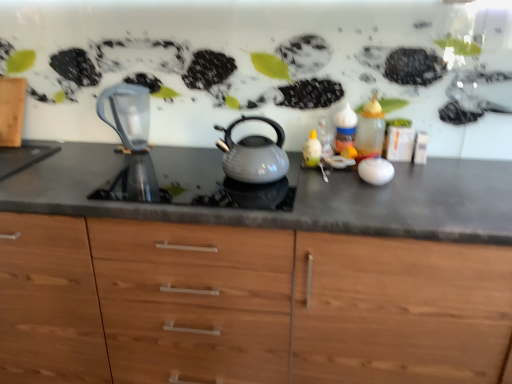
You are a GUI agent. You are given a task and a screenshot of the screen. Output one action in this format:
    pyautogui.click(x=<x>, y=<y>)
    Task: Click on the free location in front of matte gray kettle at center
    The width and height of the screenshot is (512, 384).
    Given the screenshot: What is the action you would take?
    pyautogui.click(x=260, y=198)